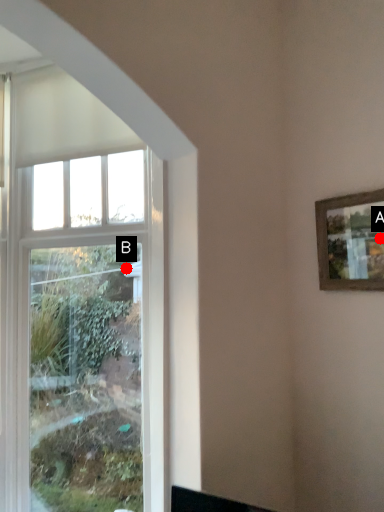
Question: Two points are circled on the image, labeled by A and B beside each circle. Which point is farther from the camera taking this photo?

Choices:
 (A) A is further
 (B) B is further

Answer: (B)